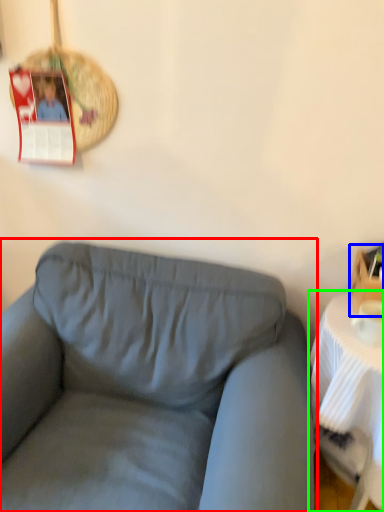
Question: Which is nearer to the studio couch (highlighted by a red box)? box (highlighted by a blue box) or table (highlighted by a green box).

Choices:
 (A) box
 (B) table

Answer: (B)